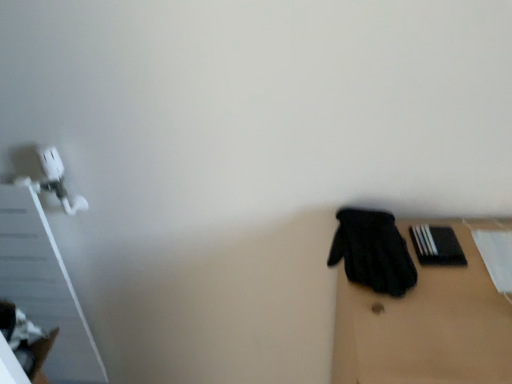
Question: Is black fabric glove at right to the left or to the right of black matte book at right in the image?

Choices:
 (A) left
 (B) right

Answer: (A)

Question: From their relative heights in the image, would you say black fabric glove at right is taller or shorter than black matte book at right?

Choices:
 (A) short
 (B) tall

Answer: (B)

Question: Based on their relative distances, which object is farther from the black matte book at right?

Choices:
 (A) black fabric glove at right
 (B) black matte gloves at right

Answer: (B)

Question: Estimate the real-world distances between objects in this image. Which object is farther from the black matte gloves at right?

Choices:
 (A) black fabric glove at right
 (B) black matte book at right

Answer: (B)